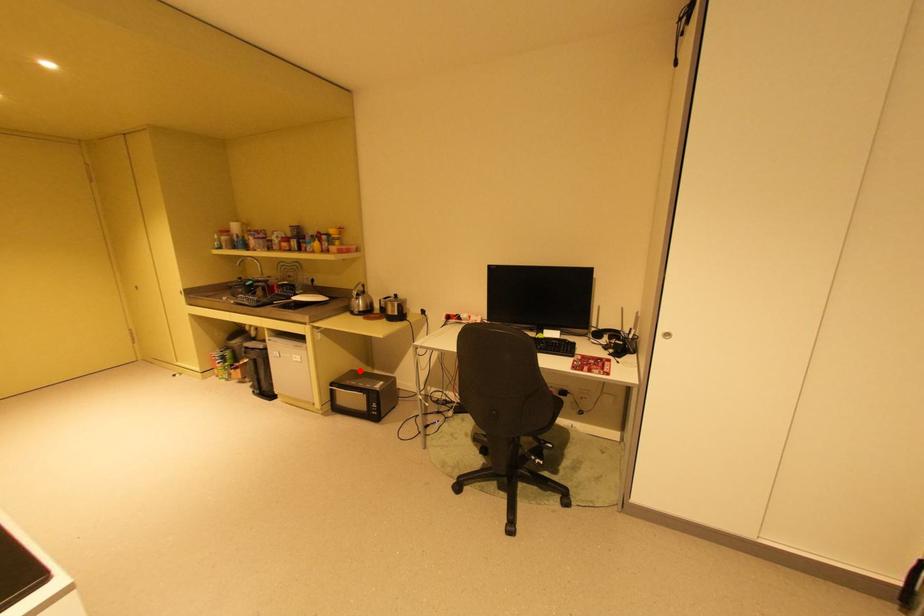
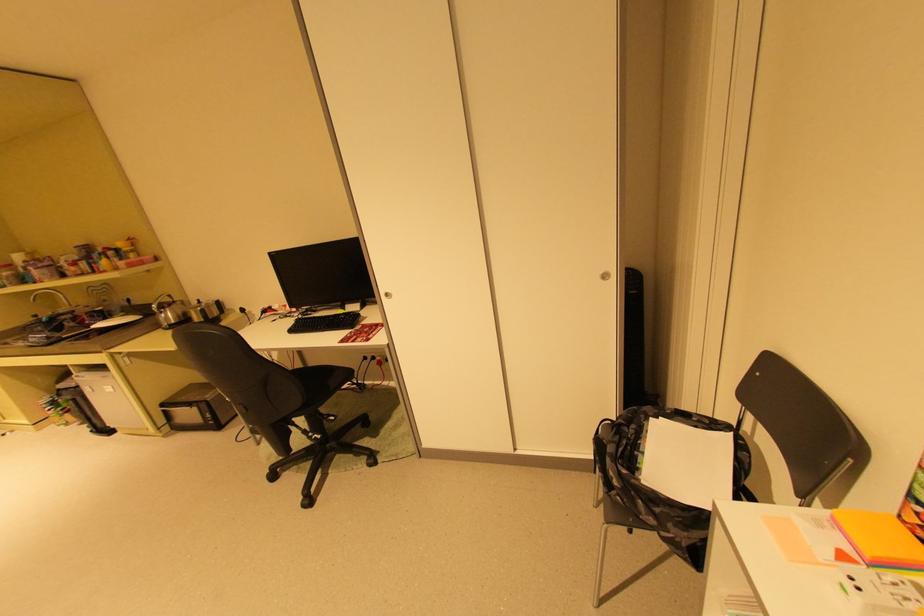
Locate, in the second image, the point that corresponds to the highlighted location in the first image.

(199, 385)